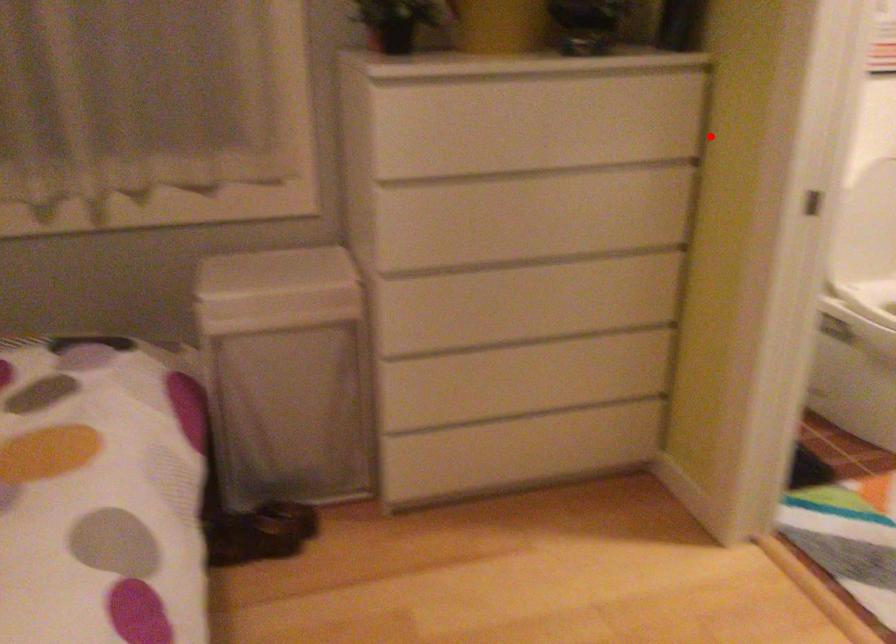
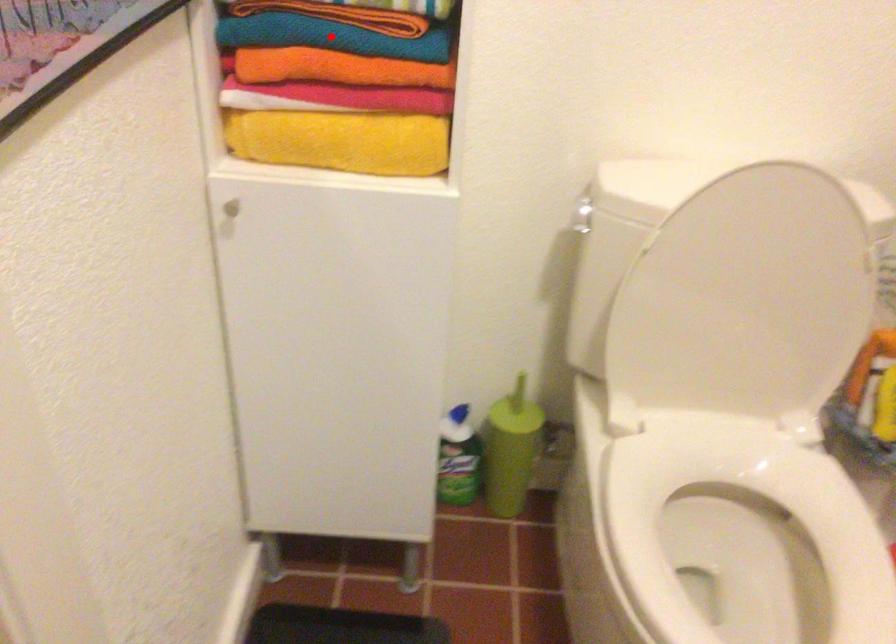
I am providing you with two images of the same scene from different viewpoints. A red point is marked on the first image and another point is marked on the second image. Does the point marked in image1 correspond to the same location as the one in image2?

Yes